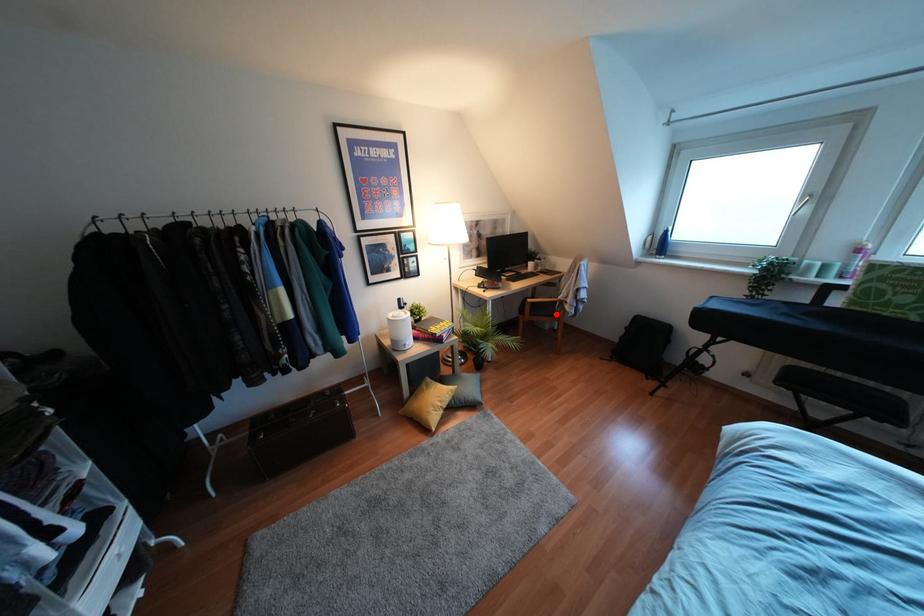
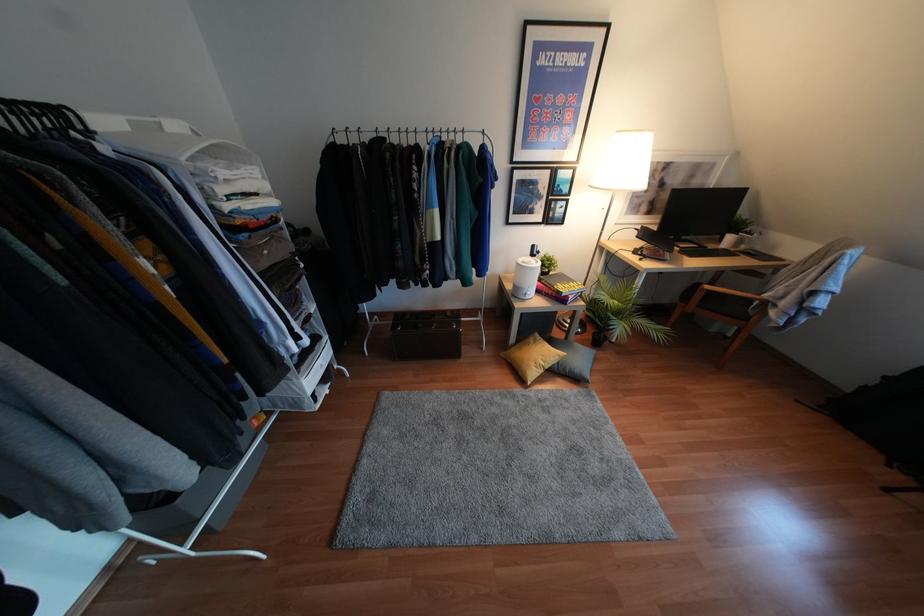
Question: I am providing you with two images of the same scene from different viewpoints. Image1 has a red point marked. In image2, the corresponding 3D location appears at what relative position? Reply with the corresponding letter.

Choices:
 (A) Closer
 (B) Farther

Answer: (A)